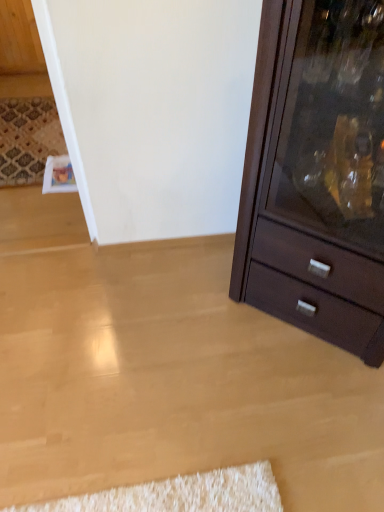
The height and width of the screenshot is (512, 384). What do you see at coordinates (28, 139) in the screenshot?
I see `patterned fabric mat at upper left` at bounding box center [28, 139].

Measure the distance between patterned fabric mat at upper left and camera.

2.16 meters.

You are a GUI agent. You are given a task and a screenshot of the screen. Output one action in this format:
    pyautogui.click(x=<x>, y=<y>)
    Task: Click on the patterned fabric mat at upper left
    The image size is (384, 512).
    Given the screenshot: What is the action you would take?
    pyautogui.click(x=28, y=139)

Where is `patterned fabric mat at upper left`? The width and height of the screenshot is (384, 512). patterned fabric mat at upper left is located at coordinates (28, 139).